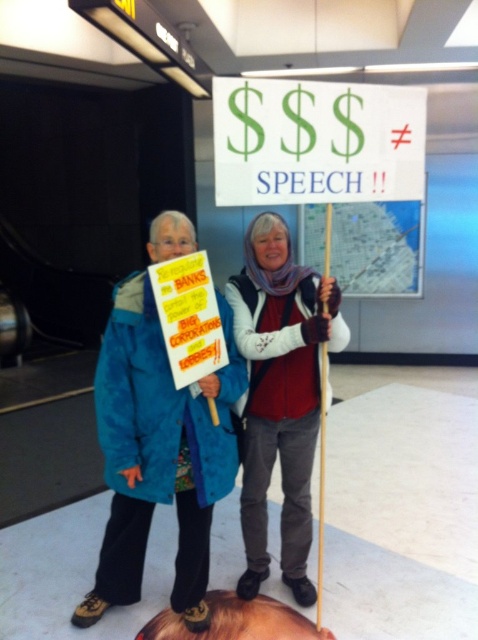
Does point (121, 353) come closer to viewer compared to point (312, 324)?

Yes, point (121, 353) is in front of point (312, 324).

Describe the element at coordinates (159, 452) in the screenshot. I see `blue fabric jacket at left` at that location.

Which is behind, point (138, 545) or point (246, 458)?

The point (246, 458) is more distant.

This screenshot has height=640, width=478. What are the coordinates of `blue fabric jacket at left` in the screenshot? It's located at (159, 452).